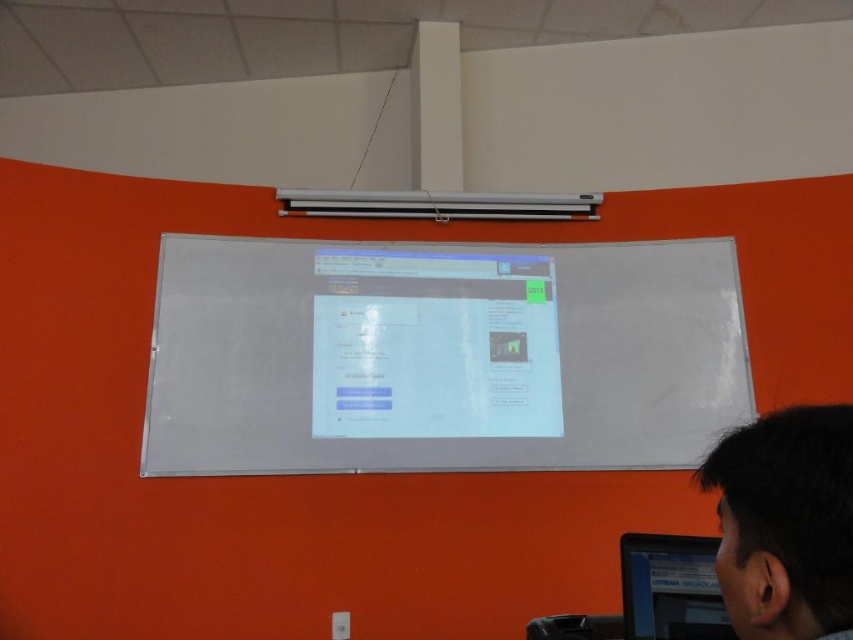
You are a GUI agent. You are given a task and a screenshot of the screen. Output one action in this format:
    pyautogui.click(x=<x>, y=<y>)
    Task: Click on the dark hair at lower right
    The height and width of the screenshot is (640, 853).
    Given the screenshot: What is the action you would take?
    pyautogui.click(x=785, y=522)

This screenshot has height=640, width=853. In order to click on dark hair at lower right in this screenshot , I will do `click(785, 522)`.

The height and width of the screenshot is (640, 853). What are the coordinates of `dark hair at lower right` in the screenshot? It's located at (785, 522).

Between point (703, 372) and point (846, 528), which one is positioned in front?

Positioned in front is point (846, 528).

Is point (157, 388) positioned after point (840, 545)?

Yes, point (157, 388) is farther from viewer.

The image size is (853, 640). In order to click on white matte board at center in this screenshot , I will do `click(440, 355)`.

Between white matte board at center and black glossy monitor at lower right, which one appears on the right side from the viewer's perspective?

black glossy monitor at lower right

Is point (277, 448) more distant than point (677, 547)?

That is True.

Describe the element at coordinates (440, 355) in the screenshot. The height and width of the screenshot is (640, 853). I see `white matte board at center` at that location.

Locate an element on the screen. white matte board at center is located at coordinates (440, 355).